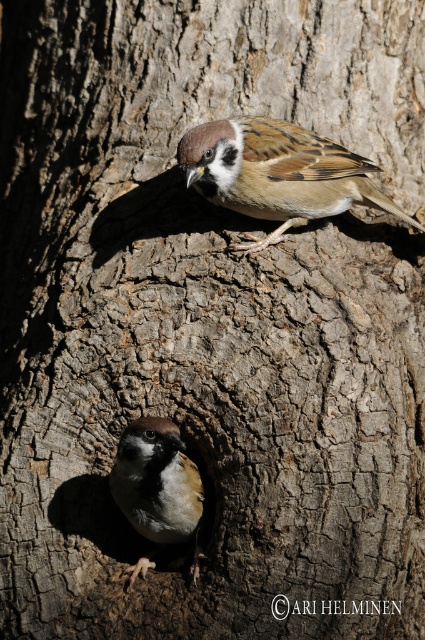
Question: Does brown speckled sparrow at upper center appear on the right side of brown feathered sparrow at lower left?

Choices:
 (A) yes
 (B) no

Answer: (A)

Question: Which object appears closest to the camera in this image?

Choices:
 (A) brown speckled sparrow at upper center
 (B) brown feathered sparrow at lower left

Answer: (B)

Question: Observing the image, what is the correct spatial positioning of brown speckled sparrow at upper center in reference to brown feathered sparrow at lower left?

Choices:
 (A) left
 (B) right

Answer: (B)

Question: Which object appears closest to the camera in this image?

Choices:
 (A) brown feathered sparrow at lower left
 (B) brown speckled sparrow at upper center

Answer: (A)

Question: Observing the image, what is the correct spatial positioning of brown speckled sparrow at upper center in reference to brown feathered sparrow at lower left?

Choices:
 (A) below
 (B) above

Answer: (B)